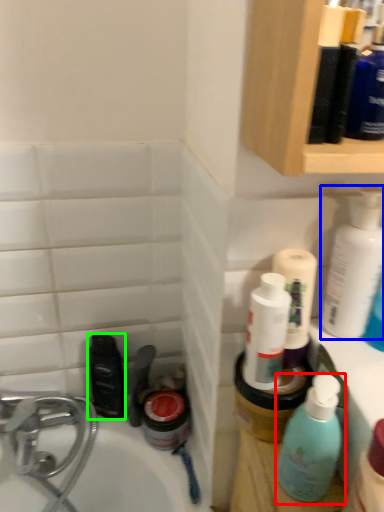
Question: Based on their relative distances, which object is nearer to bottle (highlighted by a red box)? Choose from cleaning product (highlighted by a blue box) and mouthwash (highlighted by a green box).

Choices:
 (A) cleaning product
 (B) mouthwash

Answer: (A)